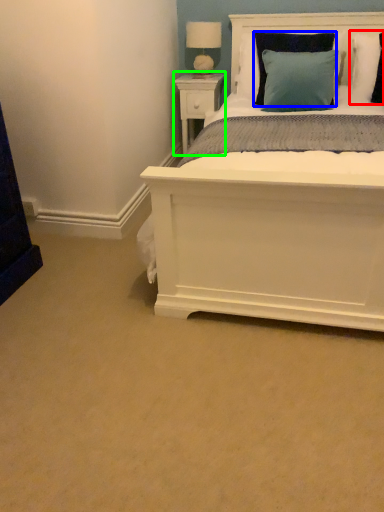
Question: Which is nearer to the pillow (highlighted by a red box)? pillow (highlighted by a blue box) or nightstand (highlighted by a green box).

Choices:
 (A) pillow
 (B) nightstand

Answer: (A)